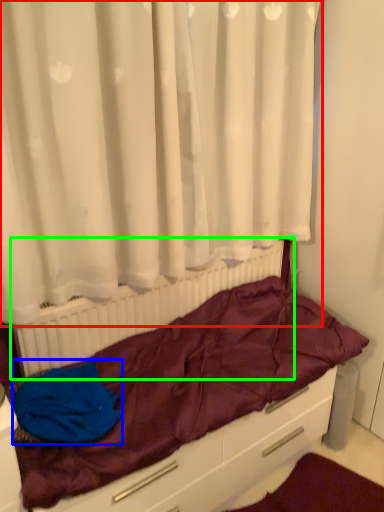
Question: Based on their relative distances, which object is nearer to curtain (highlighted by a red box)? Choose from material (highlighted by a blue box) and radiator (highlighted by a green box).

Choices:
 (A) material
 (B) radiator

Answer: (B)